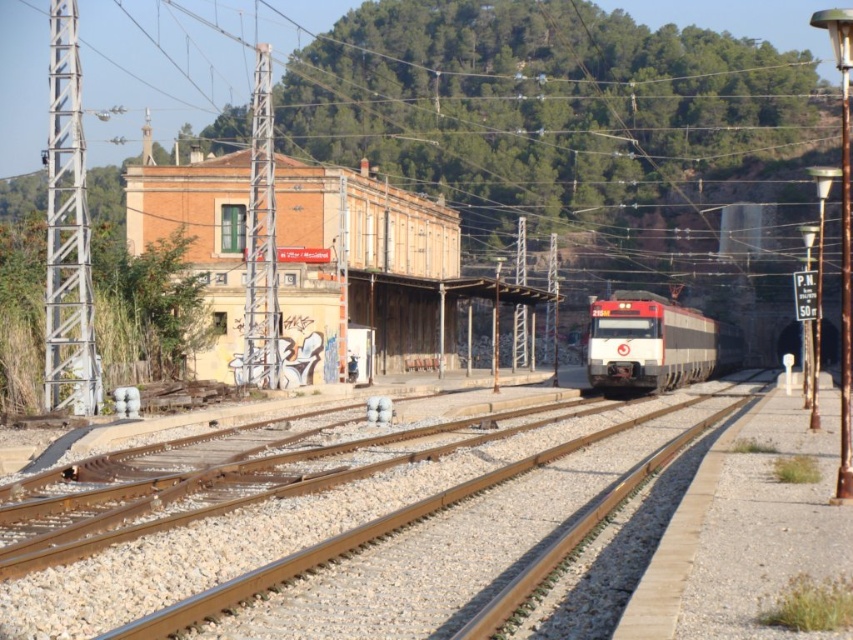
Question: Is the position of brick building at center more distant than that of red glossy train at center?

Choices:
 (A) no
 (B) yes

Answer: (A)

Question: Which point is closer to the camera?

Choices:
 (A) red glossy train at center
 (B) brown metallic train track at center

Answer: (B)

Question: Based on their relative distances, which object is nearer to the red glossy train at center?

Choices:
 (A) brown metallic train track at center
 (B) brick building at center

Answer: (B)

Question: Which point is closer to the camera taking this photo?

Choices:
 (A) (376, 368)
 (B) (453, 468)

Answer: (B)

Question: Observing the image, what is the correct spatial positioning of brick building at center in reference to red glossy train at center?

Choices:
 (A) below
 (B) above

Answer: (B)

Question: Is brown metallic train track at center thinner than red glossy train at center?

Choices:
 (A) yes
 (B) no

Answer: (A)